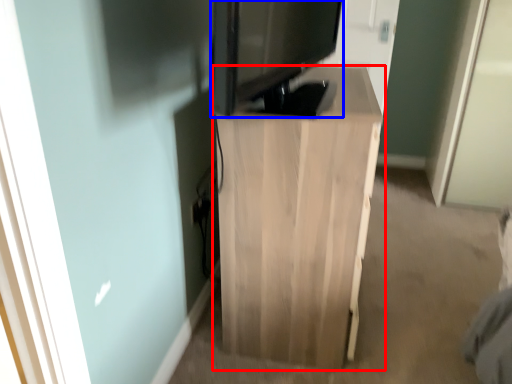
Question: Which object appears closest to the camera in this image, furniture (highlighted by a red box) or electronic (highlighted by a blue box)?

Choices:
 (A) furniture
 (B) electronic

Answer: (B)